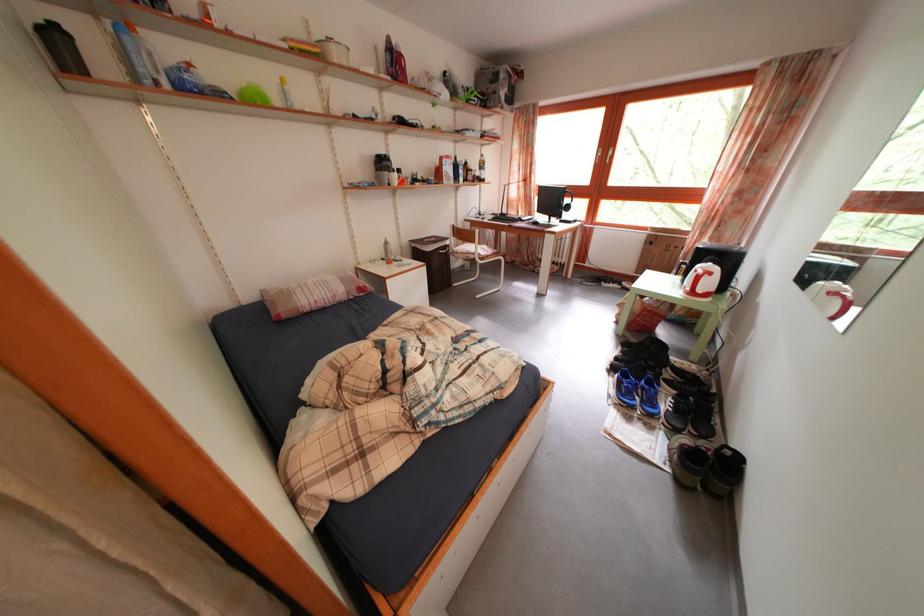
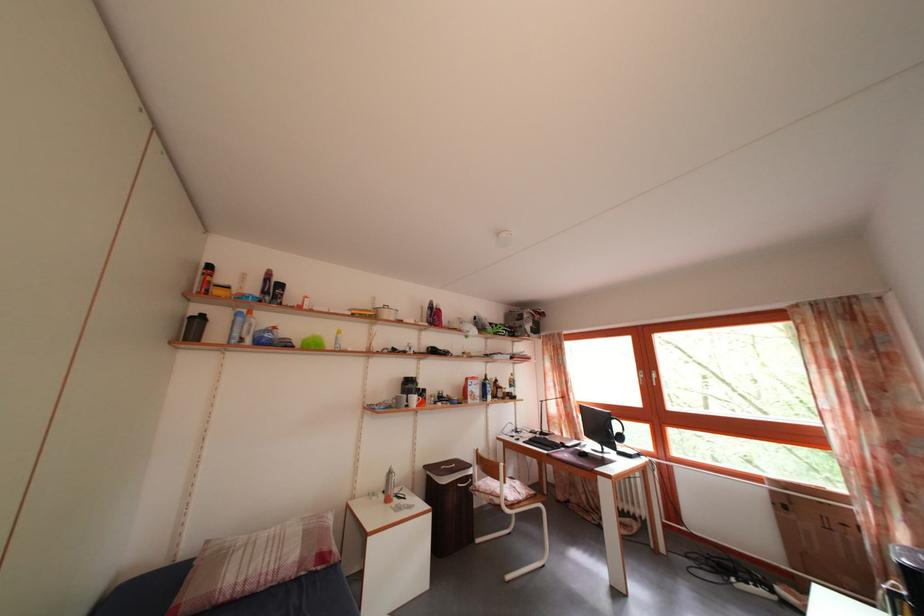
The point at (327, 312) is marked in the first image. Where is the corresponding point in the second image?

(257, 594)